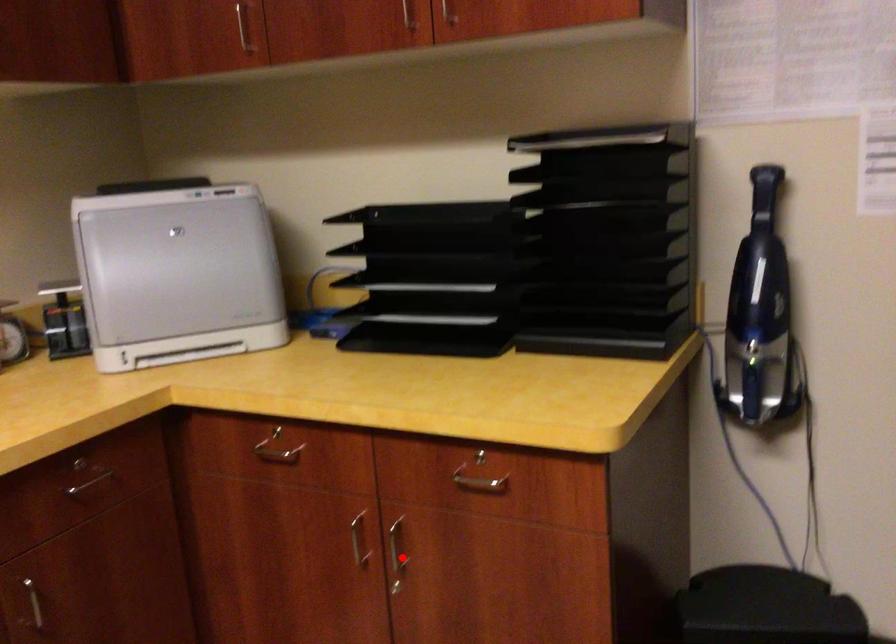
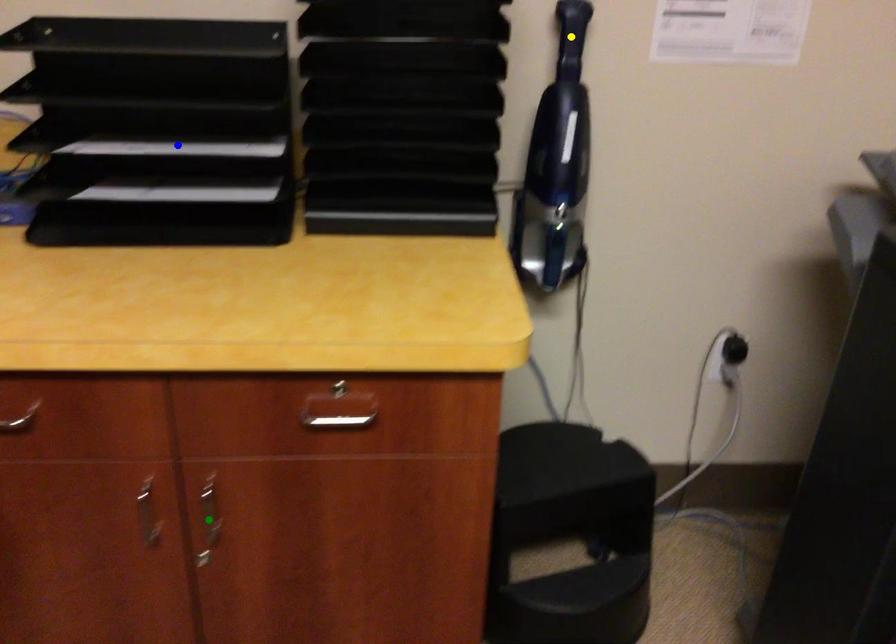
Question: I am providing you with two images of the same scene from different viewpoints. A red point is marked on the first image. You are given multiple points on the second image. Which spot in image 2 lines up with the point in image 1?

Choices:
 (A) green point
 (B) yellow point
 (C) blue point

Answer: (A)